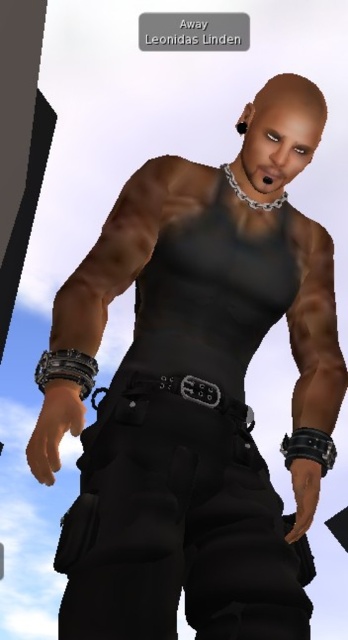
Question: Which point appears closest to the camera in this image?

Choices:
 (A) (156, 618)
 (B) (153, 381)

Answer: (A)

Question: Can you confirm if matte black tank top at center is wider than black leather belt at center?

Choices:
 (A) no
 (B) yes

Answer: (B)

Question: Observing the image, what is the correct spatial positioning of matte black tank top at center in reference to black leather belt at center?

Choices:
 (A) below
 (B) above

Answer: (B)

Question: In this image, where is matte black tank top at center located relative to black leather belt at center?

Choices:
 (A) left
 (B) right

Answer: (A)

Question: Which object is closer to the camera taking this photo?

Choices:
 (A) matte black tank top at center
 (B) black leather belt at center

Answer: (A)